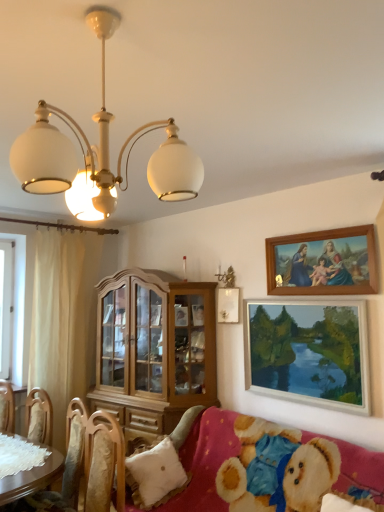
Locate an element on the screen. This screenshot has width=384, height=512. wooden picture frame at lower right, the first picture frame from the bottom is located at coordinates (309, 352).

What do you see at coordinates (154, 350) in the screenshot? I see `light wood cabinet at center` at bounding box center [154, 350].

What do you see at coordinates (323, 263) in the screenshot? I see `wooden picture frame at upper right, the 2th picture frame ordered from the bottom` at bounding box center [323, 263].

The image size is (384, 512). What do you see at coordinates (205, 461) in the screenshot?
I see `fluffy pink fabric couch at lower right` at bounding box center [205, 461].

Measure the distance between point (186, 443) and camera.

3.09 meters.

This screenshot has width=384, height=512. Identify the location of white fluffy pillow at lower left. (155, 474).

The width and height of the screenshot is (384, 512). Describe the element at coordinates (58, 324) in the screenshot. I see `beige fabric curtain at left` at that location.

In order to click on wooden chair at lower left in this screenshot , I will do `click(64, 469)`.

Is beige fabric curtain at left oriented towards wooden picture frame at upper right, marked as the 1th picture frame in a top-to-bottom arrangement?

No, beige fabric curtain at left is not aimed at wooden picture frame at upper right, marked as the 1th picture frame in a top-to-bottom arrangement.

What's the angular difference between beige fabric curtain at left and wooden picture frame at upper right, marked as the 1th picture frame in a top-to-bottom arrangement,'s facing directions?

They differ by 84 degrees in their facing directions.

Does point (32, 309) come behind point (368, 292)?

Yes, it is.

Can you confirm if wooden chair at lower left is shorter than white glossy chandelier at upper center?

Incorrect, the height of wooden chair at lower left does not fall short of that of white glossy chandelier at upper center.

Are wooden chair at lower left and white glossy chandelier at upper center far apart?

Absolutely, wooden chair at lower left is distant from white glossy chandelier at upper center.

From a real-world perspective, which is physically above, wooden chair at lower left or white glossy chandelier at upper center?

white glossy chandelier at upper center, from a real-world perspective.

This screenshot has height=512, width=384. I want to click on chair on the left of white glossy chandelier at upper center, so click(x=64, y=469).

Which object is positioned more to the right, wooden picture frame at lower right, the first picture frame from the bottom, or white glossy chandelier at upper center?

Positioned to the right is wooden picture frame at lower right, the first picture frame from the bottom.

Looking at this image, between wooden picture frame at lower right, marked as the second picture frame in a top-to-bottom arrangement, and white glossy chandelier at upper center, which one has more height?

wooden picture frame at lower right, marked as the second picture frame in a top-to-bottom arrangement.

Considering the relative positions of wooden picture frame at lower right, marked as the second picture frame in a top-to-bottom arrangement, and white glossy chandelier at upper center in the image provided, is wooden picture frame at lower right, marked as the second picture frame in a top-to-bottom arrangement, in front of white glossy chandelier at upper center?

No, it is behind white glossy chandelier at upper center.

Based on the photo, is wooden picture frame at lower right, marked as the second picture frame in a top-to-bottom arrangement, a part of wooden chair at lower left?

No, wooden picture frame at lower right, marked as the second picture frame in a top-to-bottom arrangement, is not surrounded by wooden chair at lower left.

Considering the relative positions of wooden chair at lower left and wooden picture frame at lower right, marked as the second picture frame in a top-to-bottom arrangement, in the image provided, is wooden chair at lower left to the left of wooden picture frame at lower right, marked as the second picture frame in a top-to-bottom arrangement, from the viewer's perspective?

Yes.

Is wooden chair at lower left touching wooden picture frame at lower right, the first picture frame from the bottom?

wooden chair at lower left and wooden picture frame at lower right, the first picture frame from the bottom, are not in contact.

Where is `chair below the wooden picture frame at lower right, marked as the second picture frame in a top-to-bottom arrangement (from a real-world perspective)`? Image resolution: width=384 pixels, height=512 pixels. chair below the wooden picture frame at lower right, marked as the second picture frame in a top-to-bottom arrangement (from a real-world perspective) is located at coordinates (64, 469).

Is white glossy chandelier at upper center positioned with its back to wooden picture frame at lower right, the first picture frame from the bottom?

No, white glossy chandelier at upper center is not facing the opposite direction of wooden picture frame at lower right, the first picture frame from the bottom.

Is white glossy chandelier at upper center far away from wooden picture frame at lower right, marked as the second picture frame in a top-to-bottom arrangement?

Yes, white glossy chandelier at upper center and wooden picture frame at lower right, marked as the second picture frame in a top-to-bottom arrangement, are quite far apart.

Considering the relative sizes of white glossy chandelier at upper center and wooden picture frame at lower right, marked as the second picture frame in a top-to-bottom arrangement, in the image provided, is white glossy chandelier at upper center bigger than wooden picture frame at lower right, marked as the second picture frame in a top-to-bottom arrangement,?

Correct, white glossy chandelier at upper center is larger in size than wooden picture frame at lower right, marked as the second picture frame in a top-to-bottom arrangement.

Who is shorter, white glossy chandelier at upper center or wooden picture frame at lower right, the first picture frame from the bottom?

With less height is white glossy chandelier at upper center.

Does white glossy chandelier at upper center have a smaller size compared to light wood cabinet at center?

Indeed, white glossy chandelier at upper center has a smaller size compared to light wood cabinet at center.

In terms of height, does white glossy chandelier at upper center look taller or shorter compared to light wood cabinet at center?

white glossy chandelier at upper center is shorter than light wood cabinet at center.

Is white glossy chandelier at upper center oriented towards light wood cabinet at center?

No, white glossy chandelier at upper center is not oriented towards light wood cabinet at center.

Considering the positions of objects light wood cabinet at center and white glossy chandelier at upper center in the image provided, who is more to the right, light wood cabinet at center or white glossy chandelier at upper center?

From the viewer's perspective, white glossy chandelier at upper center appears more on the right side.

In terms of height, does light wood cabinet at center look taller or shorter compared to white glossy chandelier at upper center?

In the image, light wood cabinet at center appears to be taller than white glossy chandelier at upper center.

Is light wood cabinet at center not inside white glossy chandelier at upper center?

light wood cabinet at center is positioned outside white glossy chandelier at upper center.

Is white glossy chandelier at upper center at the back of light wood cabinet at center?

No, light wood cabinet at center's orientation is not away from white glossy chandelier at upper center.

You are a GUI agent. You are given a task and a screenshot of the screen. Output one action in this format:
    pyautogui.click(x=<x>, y=<y>)
    Task: Click on the curtain behind the wooden picture frame at upper right, marked as the 1th picture frame in a top-to-bottom arrangement
    The image size is (384, 512).
    Given the screenshot: What is the action you would take?
    pyautogui.click(x=58, y=324)

The width and height of the screenshot is (384, 512). Find the location of `lamp that appears above the wooden chair at lower left (from a real-world perspective)`. lamp that appears above the wooden chair at lower left (from a real-world perspective) is located at coordinates (99, 152).

Looking at the image, which one is located closer to white fluffy pillow at lower left, fluffy pink fabric couch at lower right or white glossy chandelier at upper center?

fluffy pink fabric couch at lower right is positioned closer to the anchor white fluffy pillow at lower left.

Consider the image. Based on their spatial positions, is white fluffy pillow at lower left or white glossy chandelier at upper center further from fluffy pink fabric couch at lower right?

white glossy chandelier at upper center.

Which object lies further to the anchor point white fluffy pillow at lower left, wooden picture frame at lower right, marked as the second picture frame in a top-to-bottom arrangement, or white glossy chandelier at upper center?

Based on the image, white glossy chandelier at upper center appears to be further to white fluffy pillow at lower left.

Which object lies nearer to the anchor point wooden picture frame at upper right, the 2th picture frame ordered from the bottom, white glossy chandelier at upper center or wooden picture frame at lower right, the first picture frame from the bottom?

The object closer to wooden picture frame at upper right, the 2th picture frame ordered from the bottom, is wooden picture frame at lower right, the first picture frame from the bottom.

Based on their spatial positions, is wooden chair at lower left or white glossy chandelier at upper center further from light wood cabinet at center?

white glossy chandelier at upper center is positioned further to the anchor light wood cabinet at center.

Based on the photo, estimate the real-world distances between objects in this image. Which object is closer to wooden picture frame at lower right, marked as the second picture frame in a top-to-bottom arrangement, wooden chair at lower left or fluffy pink fabric couch at lower right?

fluffy pink fabric couch at lower right is closer to wooden picture frame at lower right, marked as the second picture frame in a top-to-bottom arrangement.

From the image, which object appears to be nearer to wooden picture frame at lower right, marked as the second picture frame in a top-to-bottom arrangement, beige fabric curtain at left or wooden chair at lower left?

Among the two, wooden chair at lower left is located nearer to wooden picture frame at lower right, marked as the second picture frame in a top-to-bottom arrangement.

When comparing their distances from wooden chair at lower left, does light wood cabinet at center or fluffy pink fabric couch at lower right seem further?

The object further to wooden chair at lower left is light wood cabinet at center.

Where is `chair between beige fabric curtain at left and wooden picture frame at upper right, the 2th picture frame ordered from the bottom, from left to right`? This screenshot has width=384, height=512. chair between beige fabric curtain at left and wooden picture frame at upper right, the 2th picture frame ordered from the bottom, from left to right is located at coordinates (64, 469).

The height and width of the screenshot is (512, 384). What are the coordinates of `pillow located between fluffy pink fabric couch at lower right and light wood cabinet at center in the depth direction` in the screenshot? It's located at (155, 474).

In order to click on cabinetry located between fluffy pink fabric couch at lower right and beige fabric curtain at left in the depth direction in this screenshot , I will do `click(154, 350)`.

Where is `chair situated between beige fabric curtain at left and wooden picture frame at lower right, marked as the second picture frame in a top-to-bottom arrangement, from left to right`? The image size is (384, 512). chair situated between beige fabric curtain at left and wooden picture frame at lower right, marked as the second picture frame in a top-to-bottom arrangement, from left to right is located at coordinates (64, 469).